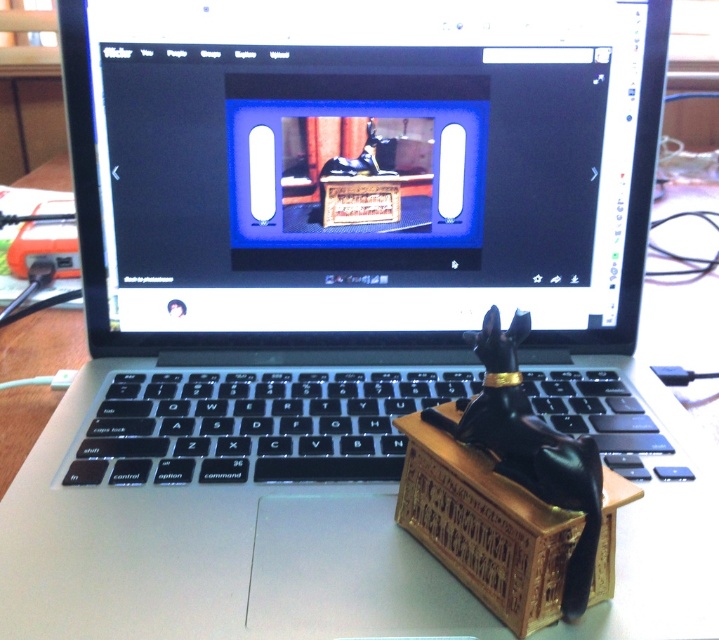
Question: Can you confirm if black plastic keyboard at center is thinner than blue glossy frame at center?

Choices:
 (A) yes
 (B) no

Answer: (B)

Question: Does black glossy monitor at center appear over gold carved wooden crate at center?

Choices:
 (A) no
 (B) yes

Answer: (B)

Question: Which object appears farthest from the camera in this image?

Choices:
 (A) blue glossy frame at center
 (B) black plastic keyboard at center
 (C) gold carved wooden crate at center
 (D) black glossy monitor at center

Answer: (A)

Question: Can you confirm if black glossy monitor at center is positioned above black plastic keyboard at center?

Choices:
 (A) no
 (B) yes

Answer: (B)

Question: Which of the following is the farthest from the observer?

Choices:
 (A) black glossy monitor at center
 (B) black plastic keyboard at center
 (C) gold carved wooden crate at center
 (D) blue glossy frame at center

Answer: (D)

Question: Which object appears farthest from the camera in this image?

Choices:
 (A) black plastic keyboard at center
 (B) gold carved wooden crate at center
 (C) black glossy monitor at center
 (D) blue glossy frame at center

Answer: (D)